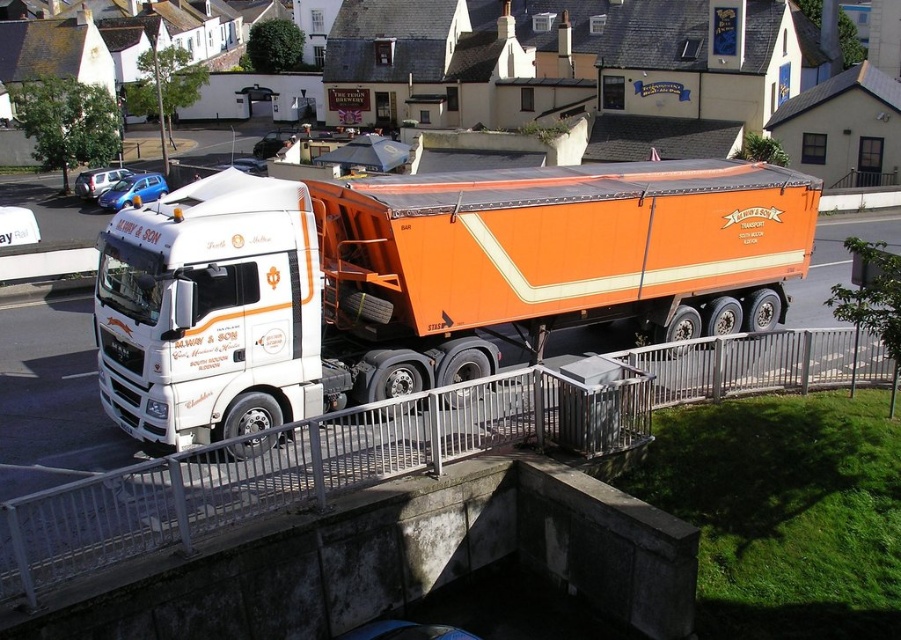
Is orange matte trailer truck at center smaller than white metal rail at center?

Incorrect, orange matte trailer truck at center is not smaller in size than white metal rail at center.

Which of these two, orange matte trailer truck at center or white metal rail at center, stands taller?

Standing taller between the two is orange matte trailer truck at center.

Is point (424, 282) farther from viewer compared to point (580, 452)?

Yes.

Identify the location of orange matte trailer truck at center. This screenshot has height=640, width=901. (419, 280).